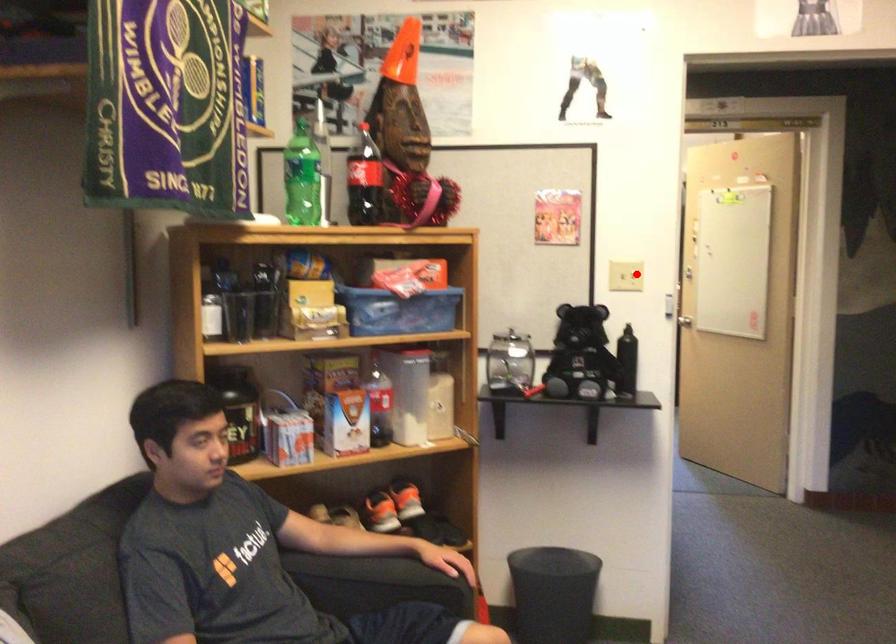
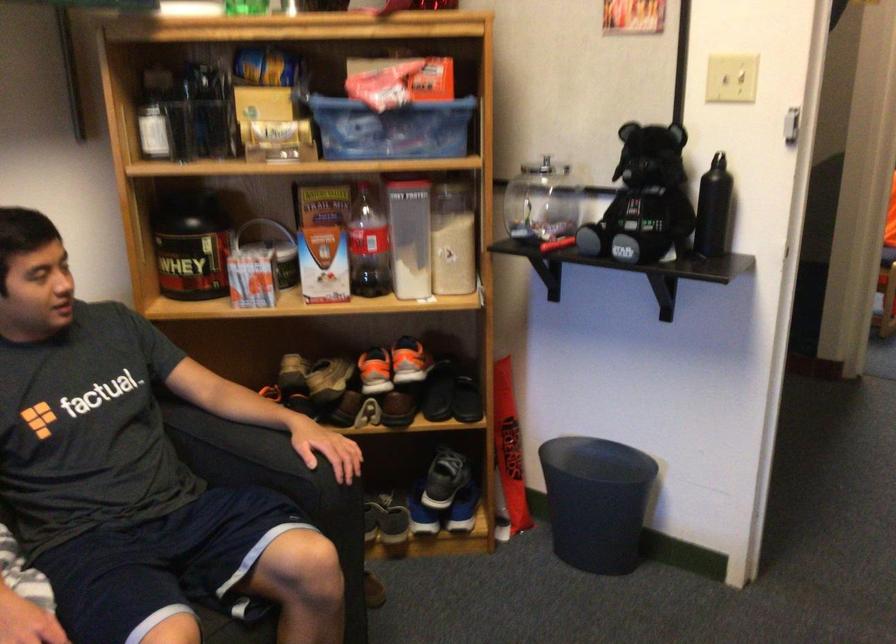
Question: I am providing you with two images of the same scene from different viewpoints. In image1, a red point is highlighted. Considering the same 3D point in image2, which of the following is correct?

Choices:
 (A) It is closer
 (B) It is farther

Answer: (A)